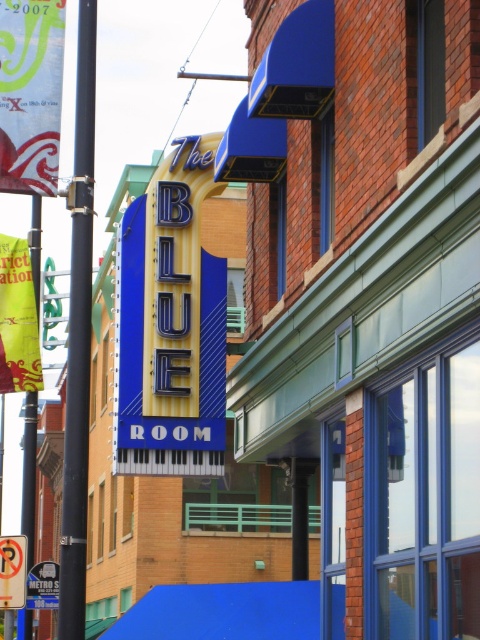
Can you confirm if yellow fabric sign at left is positioned to the left of metallic silver bus stop sign at center?

In fact, yellow fabric sign at left is to the right of metallic silver bus stop sign at center.

Does yellow fabric sign at left have a greater width compared to metallic silver bus stop sign at center?

No, yellow fabric sign at left is not wider than metallic silver bus stop sign at center.

Identify the location of yellow fabric sign at left. (17, 320).

The height and width of the screenshot is (640, 480). What do you see at coordinates (79, 339) in the screenshot?
I see `black metal pole at left` at bounding box center [79, 339].

Is black metal pole at left below green fabric sign at upper left?

Indeed, black metal pole at left is positioned under green fabric sign at upper left.

Who is more forward, (76,81) or (9,13)?

Positioned in front is point (76,81).

This screenshot has height=640, width=480. Find the location of `black metal pole at left`. black metal pole at left is located at coordinates (79, 339).

This screenshot has width=480, height=640. Identify the location of green fabric sign at upper left. (29, 93).

Find the location of a particular element. green fabric sign at upper left is located at coordinates (29, 93).